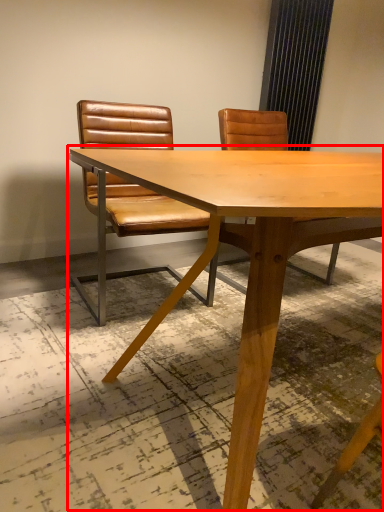
Question: From the image's perspective, considering the relative positions of table (annotated by the red box) and chair in the image provided, where is table (annotated by the red box) located with respect to the staircase?

Choices:
 (A) below
 (B) above

Answer: (A)